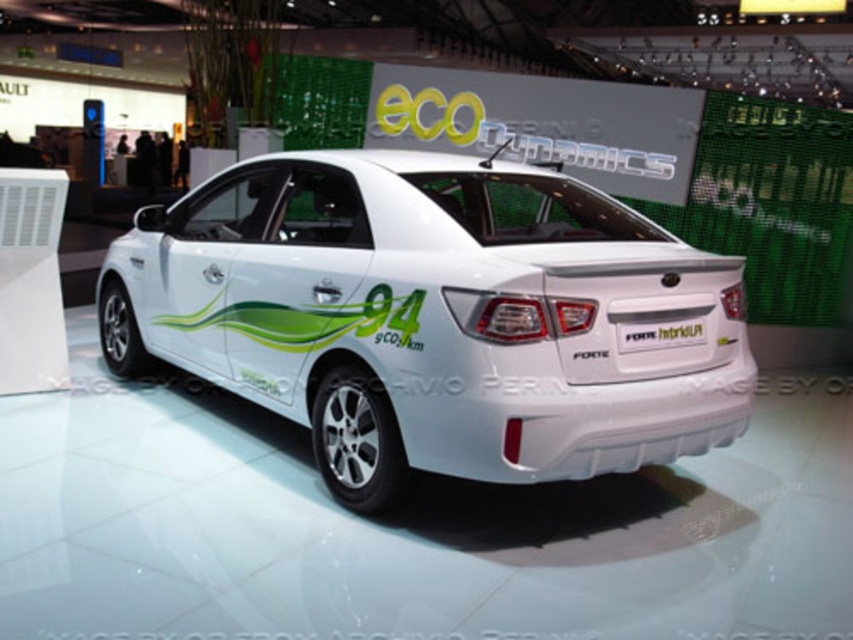
Question: Does white glossy car at center come behind white plastic license plate at center?

Choices:
 (A) no
 (B) yes

Answer: (A)

Question: Observing the image, what is the correct spatial positioning of white glossy car at center in reference to white plastic license plate at center?

Choices:
 (A) below
 (B) above

Answer: (B)

Question: Is white glossy car at center closer to camera compared to white plastic license plate at center?

Choices:
 (A) no
 (B) yes

Answer: (B)

Question: Which point is closer to the camera taking this photo?

Choices:
 (A) (712, 436)
 (B) (660, 326)

Answer: (B)

Question: Among these objects, which one is farthest from the camera?

Choices:
 (A) white plastic license plate at center
 (B) white glossy car at center

Answer: (A)